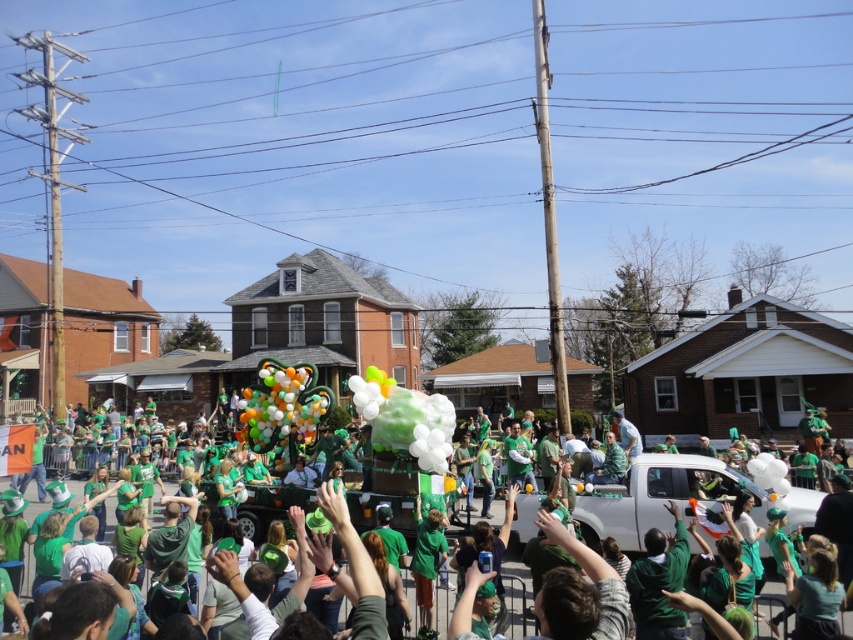
You are a photographer standing in the crowd at the parade. You want to capture a photo that includes both the translucent green cloud at center and the multicolored glossy balloons at center. Based on their positions, which object should appear higher in your photo?

The translucent green cloud at center is positioned over the multicolored glossy balloons at center, so it will appear higher in the photo.

You are a photographer standing at the edge of the crowd. You want to capture a photo that includes both the green fabric float at center and the multicolored glossy balloons at center. Given that your camera has a maximum focus range of 25 feet, will you be able to get both objects in focus?

The green fabric float at center is 28.46 feet away from the multicolored glossy balloons at center. Since the distance between them exceeds the camera maximum focus range of 25 feet, you won the be able to get both objects in focus.